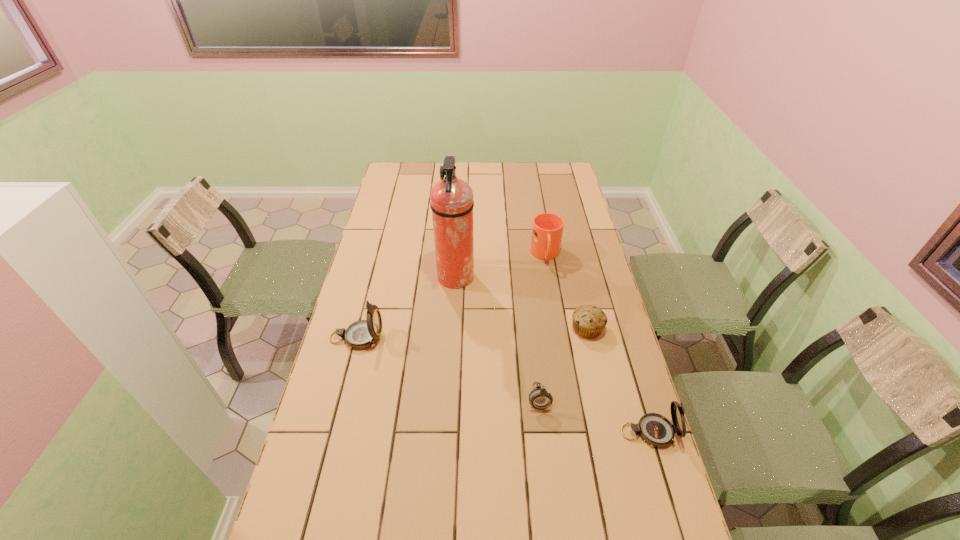
This screenshot has height=540, width=960. In order to click on the leftmost compass in this screenshot , I will do (362, 334).

Find the location of a particular element. This screenshot has height=540, width=960. the leftmost object is located at coordinates click(x=362, y=334).

Find the location of `the shortest compass`. the shortest compass is located at coordinates (539, 398).

At what (x,y) coordinates should I click in order to perform the action: click on the second nearest object. Please return your answer as a coordinate pair (x, y). Looking at the image, I should click on tap(539, 398).

Identify the location of the second shortest compass. The height and width of the screenshot is (540, 960). (656, 430).

Identify the location of the nearest compass. This screenshot has height=540, width=960. (656, 430).

Identify the location of mug. Image resolution: width=960 pixels, height=540 pixels. (547, 230).

The width and height of the screenshot is (960, 540). Identify the location of the fifth object from right to left. (452, 203).

I want to click on the tallest object, so [452, 203].

The height and width of the screenshot is (540, 960). What are the coordinates of `muffin` in the screenshot? It's located at (589, 321).